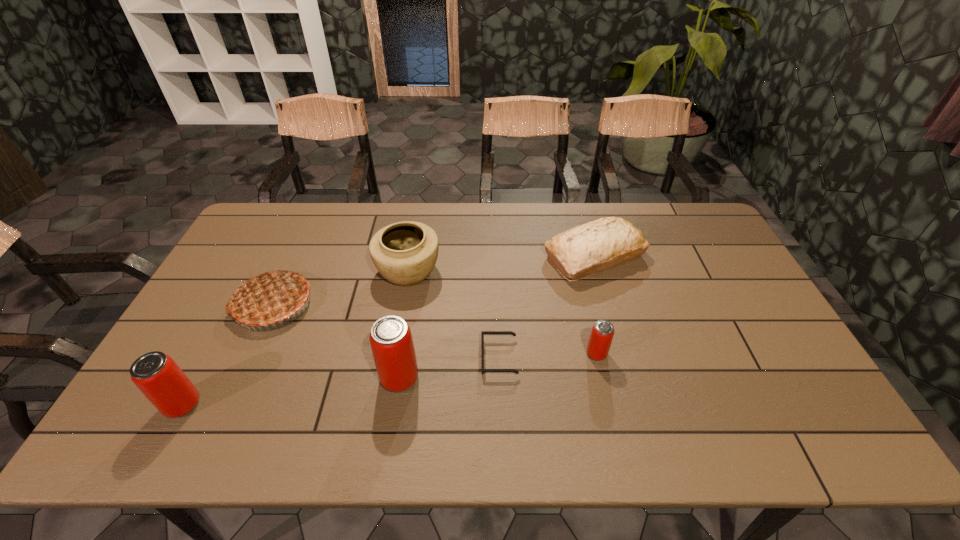
Please point out where to position a new beer can on the right to maintain spacing. Please provide its 2D coordinates. Your answer should be formatted as a tuple, i.e. [(x, y)], where the tuple contains the x and y coordinates of a point satisfying the conditions above.

[(777, 332)]